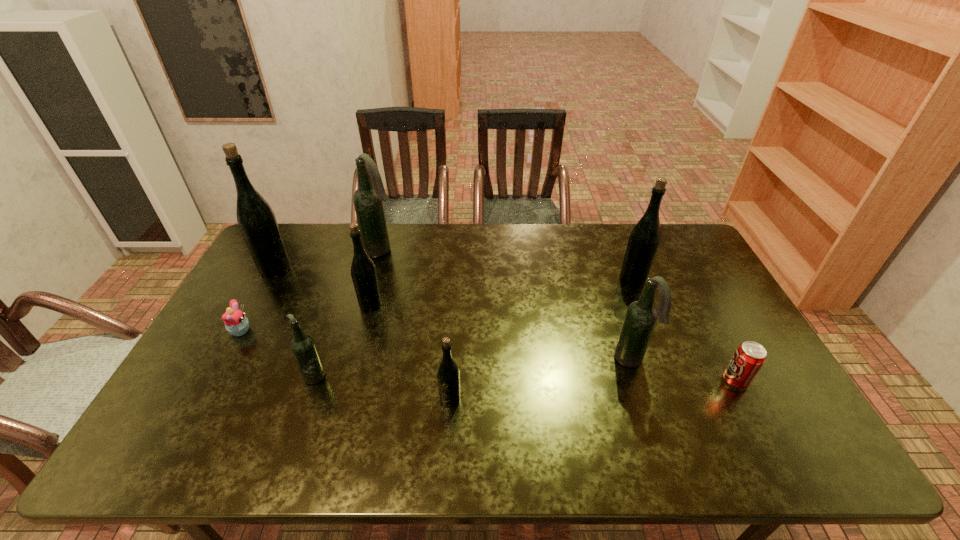
Locate which dark beer bottle ranks in proximity to the rightmost green beer bottle. Please provide its 2D coordinates. Your answer should be formatted as a tuple, i.e. [(x, y)], where the tuple contains the x and y coordinates of a point satisfying the conditions above.

[(641, 316)]

You are a GUI agent. You are given a task and a screenshot of the screen. Output one action in this format:
    pyautogui.click(x=<x>, y=<y>)
    Task: Click on the free point that satisfies the following two spatial constraints: 1. on the back side of the rightmost beer bottle; 2. on the left side of the second beer bottle from right to left
    
    Given the screenshot: What is the action you would take?
    pyautogui.click(x=605, y=280)

The height and width of the screenshot is (540, 960). I want to click on blank area in the image that satisfies the following two spatial constraints: 1. on the back side of the fourth nearest beer bottle; 2. on the left side of the smallest dark beer bottle, so click(339, 305).

The image size is (960, 540). Identify the location of vacant region that satisfies the following two spatial constraints: 1. on the back side of the smallest green beer bottle; 2. on the face of the fifth farthest object. (454, 331).

This screenshot has width=960, height=540. What are the coordinates of `free region that satisfies the following two spatial constraints: 1. on the front side of the third green beer bottle from right to left; 2. on the right side of the biggest dark beer bottle` in the screenshot? It's located at (367, 305).

This screenshot has width=960, height=540. What are the coordinates of `free point that satisfies the following two spatial constraints: 1. on the face of the nearest beer bottle; 2. on the right side of the fifth nearest object` in the screenshot? It's located at (204, 399).